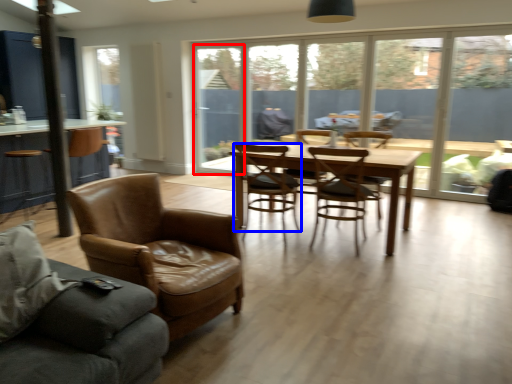
Question: Which object is further to the camera taking this photo, window screen (highlighted by a red box) or chair (highlighted by a blue box)?

Choices:
 (A) window screen
 (B) chair

Answer: (A)